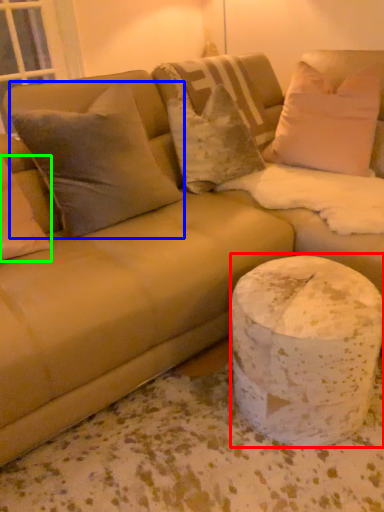
Question: Estimate the real-world distances between objects in this image. Which object is farther from marble (highlighted by a red box), pillow (highlighted by a blue box) or pillow (highlighted by a green box)?

Choices:
 (A) pillow
 (B) pillow

Answer: (B)